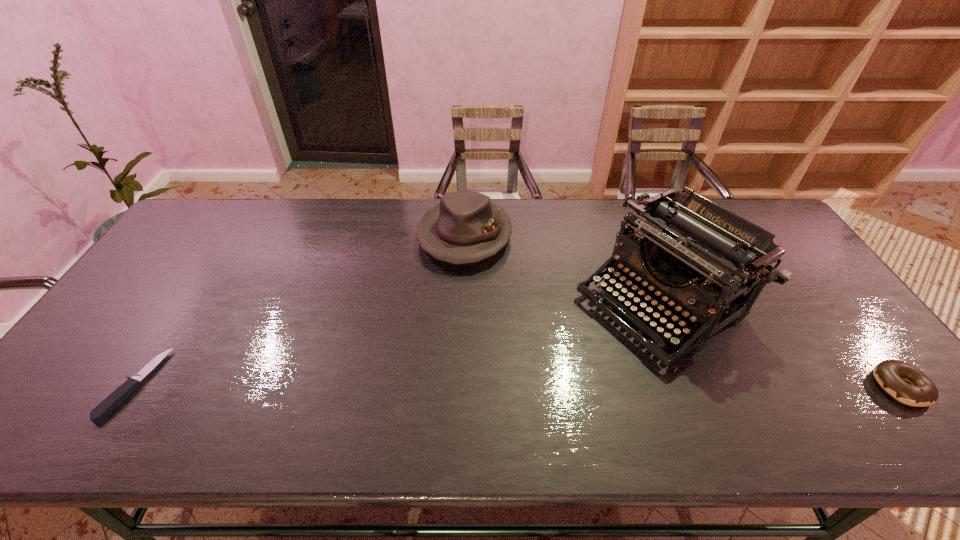
In order to click on steak knife in this screenshot , I will do `click(116, 398)`.

The height and width of the screenshot is (540, 960). I want to click on the leftmost object, so click(x=116, y=398).

I want to click on doughnut, so click(x=920, y=391).

This screenshot has height=540, width=960. In order to click on the rightmost object in this screenshot , I will do `click(920, 391)`.

Where is `typewriter`? typewriter is located at coordinates click(691, 249).

This screenshot has width=960, height=540. I want to click on the second object from right to left, so click(691, 249).

This screenshot has width=960, height=540. Find the location of `the second object from left to right`. the second object from left to right is located at coordinates (465, 227).

This screenshot has width=960, height=540. Identify the location of the third shortest object. (465, 227).

The width and height of the screenshot is (960, 540). I want to click on vacant point located 0.150m on the back of the leftmost object, so click(x=185, y=307).

Where is `free space located 0.330m on the back of the rightmost object`? The width and height of the screenshot is (960, 540). free space located 0.330m on the back of the rightmost object is located at coordinates (811, 274).